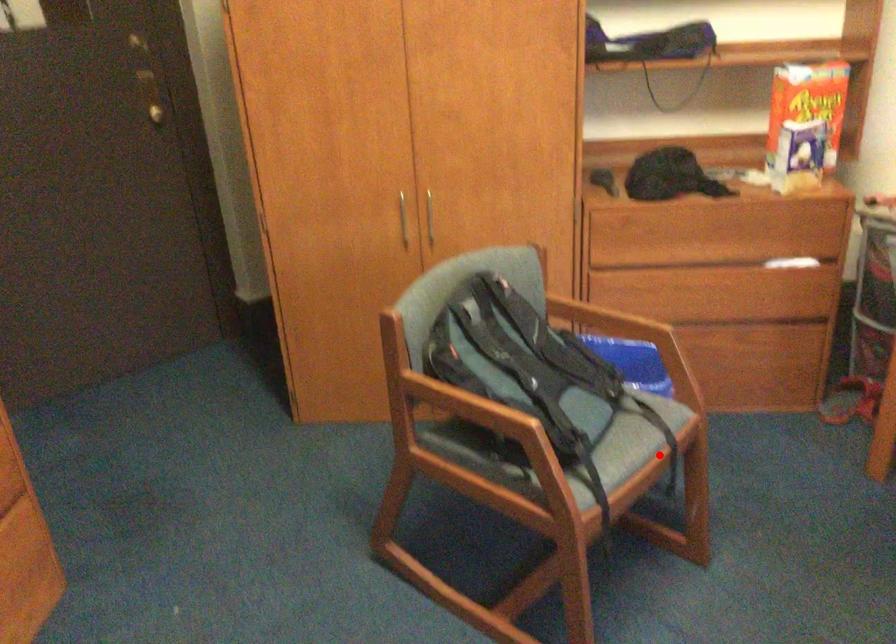
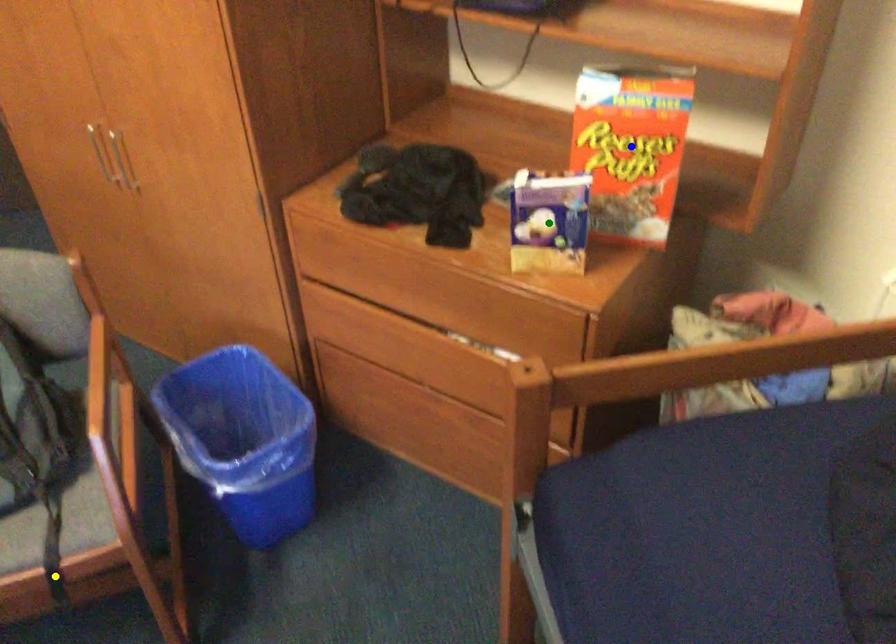
Question: I am providing you with two images of the same scene from different viewpoints. A red point is marked on the first image. You are given multiple points on the second image. In image 2, which mark is for the same physical point as the one in image 1?

Choices:
 (A) blue point
 (B) yellow point
 (C) green point

Answer: (B)